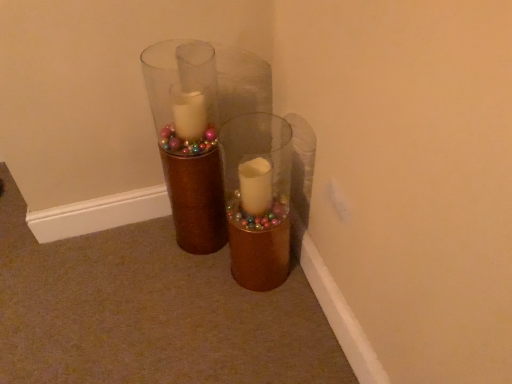
The width and height of the screenshot is (512, 384). I want to click on vacant point to the left of brown textured vase at center, the first vase when ordered from right to left, so click(203, 282).